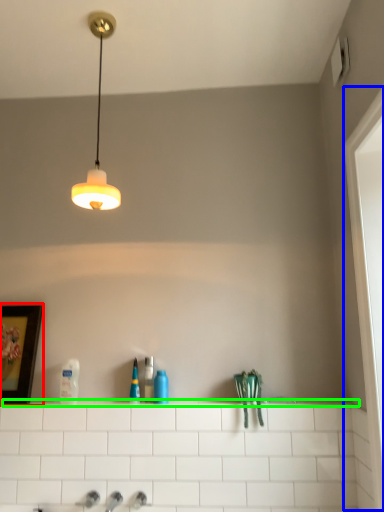
Question: Which is farther away from picture frame (highlighted by a red box)? screen door (highlighted by a blue box) or ledge (highlighted by a green box)?

Choices:
 (A) screen door
 (B) ledge

Answer: (A)